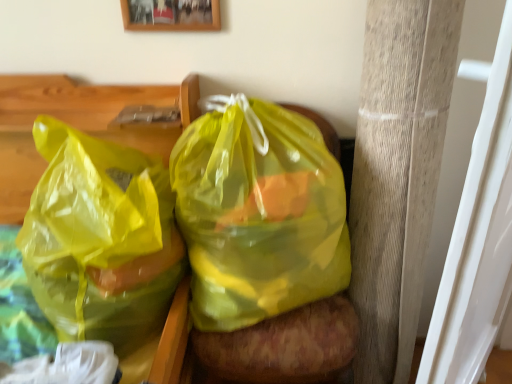
Question: Does wooden pillar at right have a greater height compared to wooden picture frame at upper center?

Choices:
 (A) yes
 (B) no

Answer: (A)

Question: Would you say wooden pillar at right is outside wooden picture frame at upper center?

Choices:
 (A) yes
 (B) no

Answer: (A)

Question: Is wooden pillar at right behind wooden picture frame at upper center?

Choices:
 (A) yes
 (B) no

Answer: (B)

Question: Does wooden pillar at right have a lesser width compared to wooden picture frame at upper center?

Choices:
 (A) no
 (B) yes

Answer: (A)

Question: Is wooden pillar at right not near wooden picture frame at upper center?

Choices:
 (A) yes
 (B) no

Answer: (B)

Question: Looking at the image, does translucent yellow plastic bag at center, which appears as the 2th plastic bag when viewed from the left, seem bigger or smaller compared to wooden picture frame at upper center?

Choices:
 (A) big
 (B) small

Answer: (A)

Question: Considering their positions, is translucent yellow plastic bag at center, which appears as the 2th plastic bag when viewed from the left, located in front of or behind wooden picture frame at upper center?

Choices:
 (A) front
 (B) behind

Answer: (A)

Question: Is translucent yellow plastic bag at center, which appears as the 2th plastic bag when viewed from the left, wider or thinner than wooden picture frame at upper center?

Choices:
 (A) thin
 (B) wide

Answer: (B)

Question: Is point (205, 157) closer or farther from the camera than point (164, 24)?

Choices:
 (A) closer
 (B) farther

Answer: (A)

Question: In terms of width, does wooden picture frame at upper center look wider or thinner when compared to translucent yellow plastic bag at left, arranged as the first plastic bag when viewed from the left?

Choices:
 (A) thin
 (B) wide

Answer: (A)

Question: Would you say wooden picture frame at upper center is to the left or to the right of translucent yellow plastic bag at left, positioned as the 2th plastic bag in right-to-left order, in the picture?

Choices:
 (A) right
 (B) left

Answer: (A)

Question: From their relative heights in the image, would you say wooden picture frame at upper center is taller or shorter than translucent yellow plastic bag at left, positioned as the 2th plastic bag in right-to-left order?

Choices:
 (A) short
 (B) tall

Answer: (A)

Question: Which is correct: wooden picture frame at upper center is inside translucent yellow plastic bag at left, arranged as the first plastic bag when viewed from the left, or outside of it?

Choices:
 (A) outside
 (B) inside

Answer: (A)

Question: Considering the positions of point (192, 137) and point (370, 57), is point (192, 137) closer or farther from the camera than point (370, 57)?

Choices:
 (A) closer
 (B) farther

Answer: (B)

Question: Which is correct: translucent yellow plastic bag at center, which appears as the 2th plastic bag when viewed from the left, is inside wooden pillar at right, or outside of it?

Choices:
 (A) outside
 (B) inside

Answer: (A)